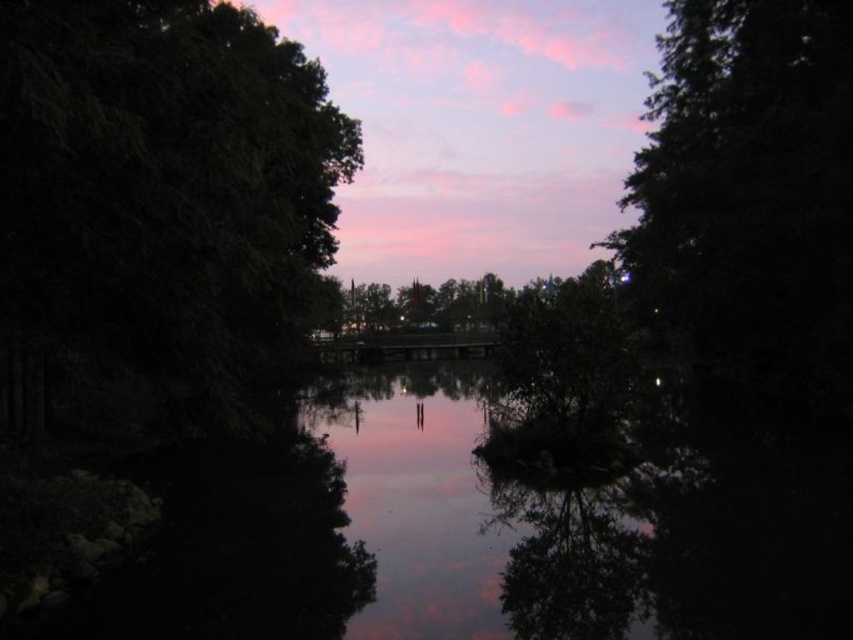
Which is more to the right, green leafy tree at left or green matte tree at center?

green matte tree at center

The image size is (853, 640). I want to click on green leafy tree at left, so click(x=160, y=193).

Find the location of a particular element. green leafy tree at left is located at coordinates (160, 193).

Measure the distance between reflective glass water at center and green matte tree at center.

reflective glass water at center and green matte tree at center are 86.94 meters apart.

Does reflective glass water at center have a greater width compared to green matte tree at center?

No, reflective glass water at center is not wider than green matte tree at center.

Locate an element on the screen. The width and height of the screenshot is (853, 640). reflective glass water at center is located at coordinates (474, 518).

Find the location of a particular element. reflective glass water at center is located at coordinates (474, 518).

Is point (792, 54) closer to camera compared to point (590, 538)?

No, (792, 54) is further to viewer.

Find the location of `dark green leafy tree at upper right`. dark green leafy tree at upper right is located at coordinates (751, 173).

Identify the location of dark green leafy tree at upper right. The width and height of the screenshot is (853, 640). (751, 173).

I want to click on dark green leafy tree at upper right, so click(x=751, y=173).